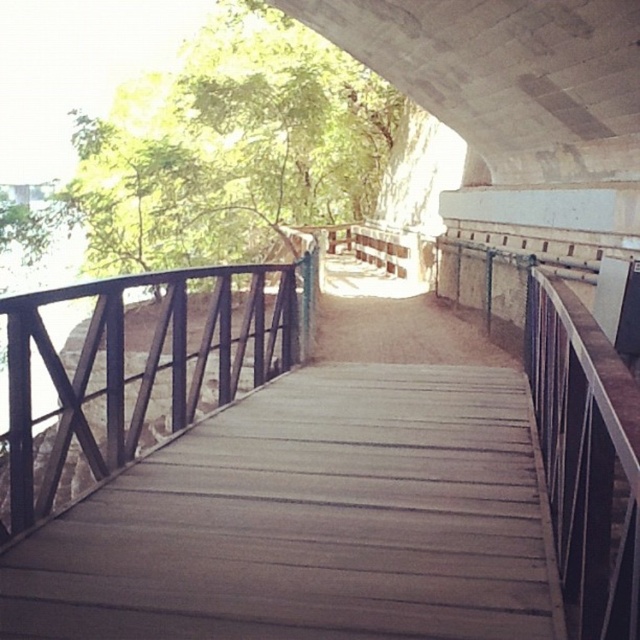
Who is more forward, (x=58, y=513) or (x=186, y=340)?

Point (x=58, y=513) is more forward.

Between point (176, 465) and point (198, 388), which one is positioned behind?

Point (198, 388)

This screenshot has height=640, width=640. Find the location of `brown wooden bridge at center`. brown wooden bridge at center is located at coordinates (308, 486).